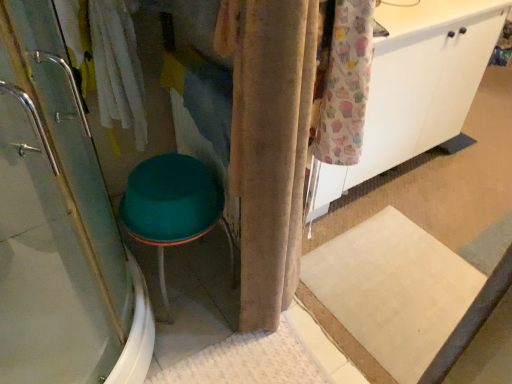
You are a GUI agent. You are given a task and a screenshot of the screen. Output one action in this format:
    pyautogui.click(x=<x>, y=<y>)
    Task: Click on the vacant region under teal plastic stool at lower left (from a real-world perspective)
    
    Given the screenshot: What is the action you would take?
    pyautogui.click(x=193, y=271)